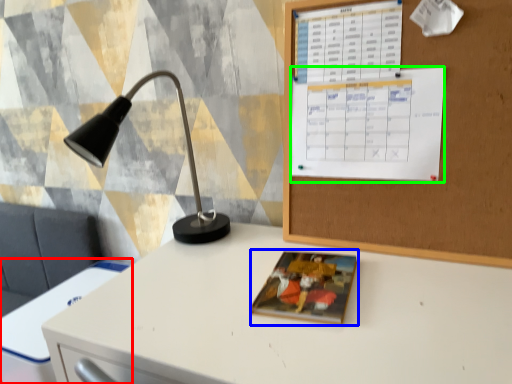
Question: Considering the real-world distances, which object is closest to computer desk (highlighted by a red box)? book cover (highlighted by a blue box) or calendar (highlighted by a green box).

Choices:
 (A) book cover
 (B) calendar

Answer: (A)